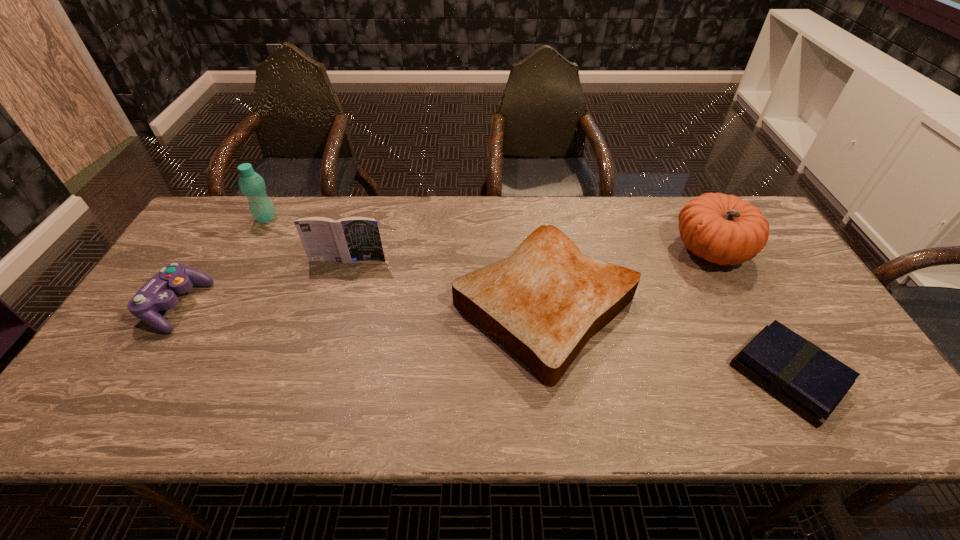
You are a GUI agent. You are given a task and a screenshot of the screen. Output one action in this format:
    pyautogui.click(x=<x>, y=<y>)
    Task: Click on the vacant area situated on the left of the pumpkin
    This screenshot has height=540, width=960.
    Given the screenshot: What is the action you would take?
    pyautogui.click(x=642, y=249)

Locate an element on the screen. The image size is (960, 540). vacant space located 0.390m on the front cover of the farther book is located at coordinates (311, 382).

At what (x,y) coordinates should I click in order to perform the action: click on free spot located 0.220m on the back of the leftmost object. Please return your answer as a coordinate pair (x, y). The width and height of the screenshot is (960, 540). Looking at the image, I should click on (224, 230).

Identify the location of free spot located 0.320m on the left of the fourth object from left to right. The width and height of the screenshot is (960, 540). (332, 306).

What are the coordinates of `free space located 0.170m on the left of the shortest object` in the screenshot? It's located at (660, 376).

Identify the location of bottle located at the far edge. (252, 185).

Locate an element on the screen. The image size is (960, 540). pumpkin situated at the far edge is located at coordinates (723, 229).

At what (x,y) coordinates should I click in order to perform the action: click on object at the near edge. Please return your answer as a coordinate pair (x, y). The image size is (960, 540). Looking at the image, I should click on (800, 374).

What are the coordinates of `bottle present at the left edge` in the screenshot? It's located at (252, 185).

Find the location of a particular element. This screenshot has width=960, height=540. control positioned at the left edge is located at coordinates (159, 293).